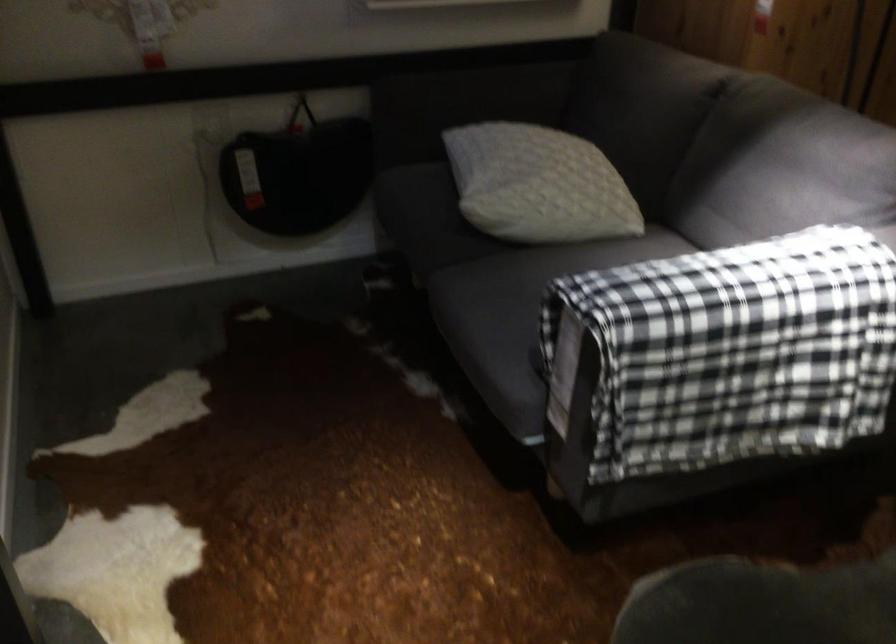
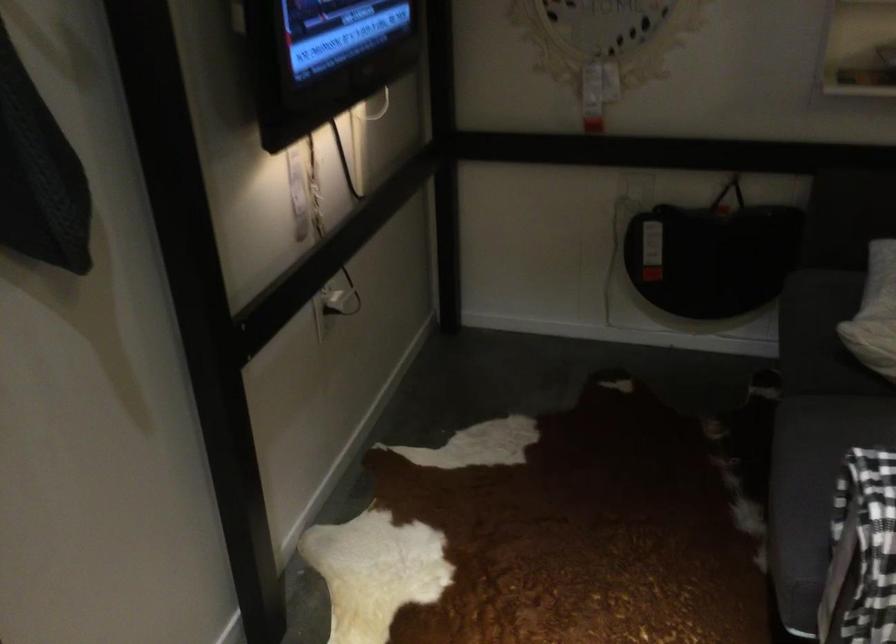
In the second image, find the point that corresponds to point (488, 341) in the first image.

(805, 494)